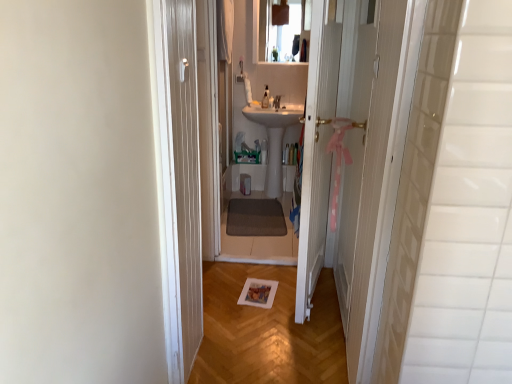
Locate an element on the screen. The height and width of the screenshot is (384, 512). vacant space underneath white glossy sink at center (from a real-world perspective) is located at coordinates (269, 195).